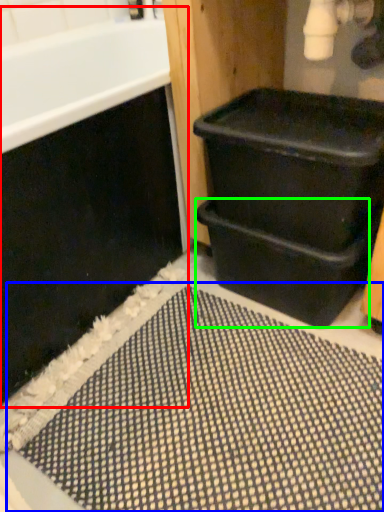
Question: Which object is the farthest from bath (highlighted by a red box)? Choose among these: bath mat (highlighted by a blue box) or drawer (highlighted by a green box).

Choices:
 (A) bath mat
 (B) drawer

Answer: (A)